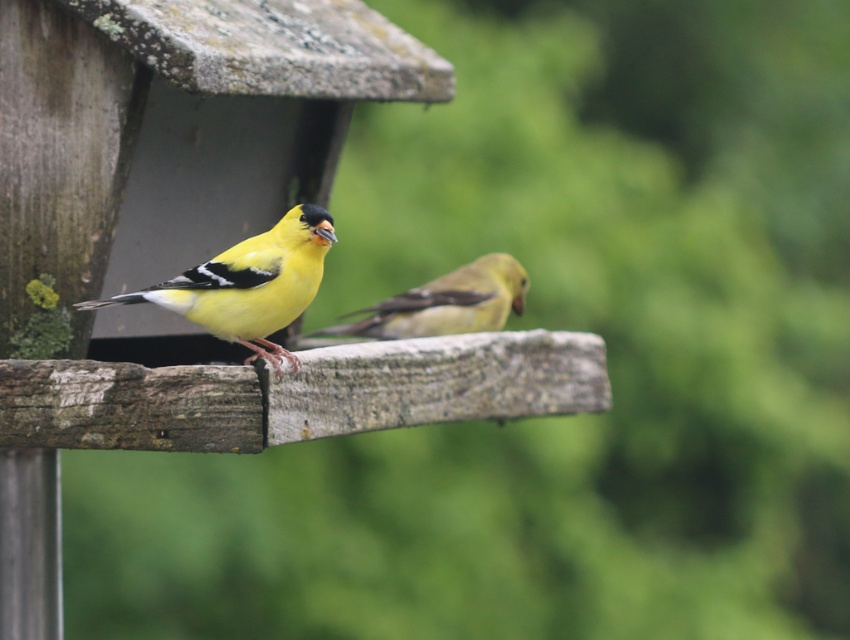
Which is in front, point (293, 243) or point (343, 324)?

Point (293, 243) is more forward.

Is yellow matte bird at center bigger than yellow matte/glossy bird at center?

Yes, yellow matte bird at center is bigger than yellow matte/glossy bird at center.

What do you see at coordinates (248, 284) in the screenshot? I see `yellow matte bird at center` at bounding box center [248, 284].

Where is `yellow matte bird at center`? yellow matte bird at center is located at coordinates (248, 284).